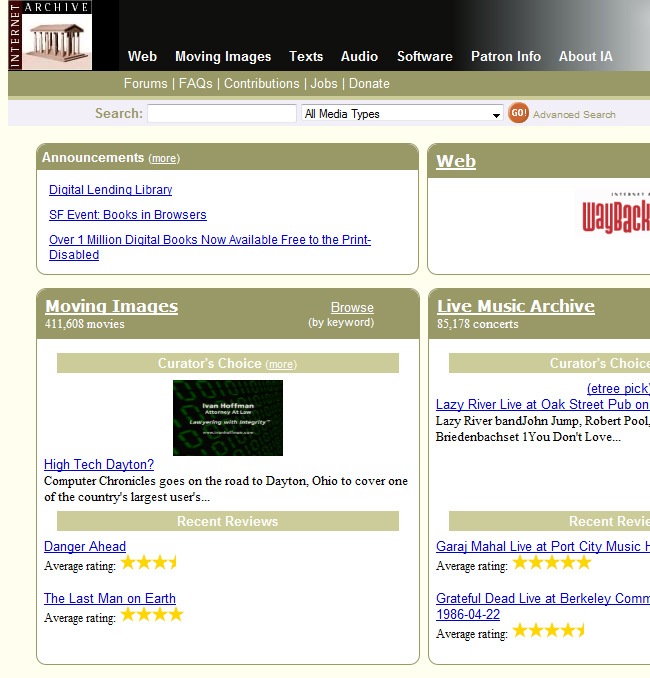
This screenshot has height=678, width=650. I want to click on libary, so click(116, 188).